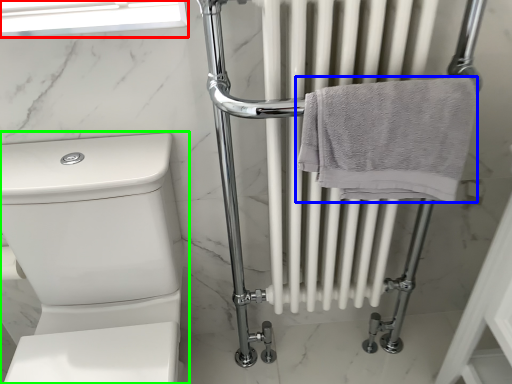
Question: Considering the real-world distances, which object is closest to window screen (highlighted by a red box)? towel (highlighted by a blue box) or toilet (highlighted by a green box).

Choices:
 (A) towel
 (B) toilet

Answer: (B)